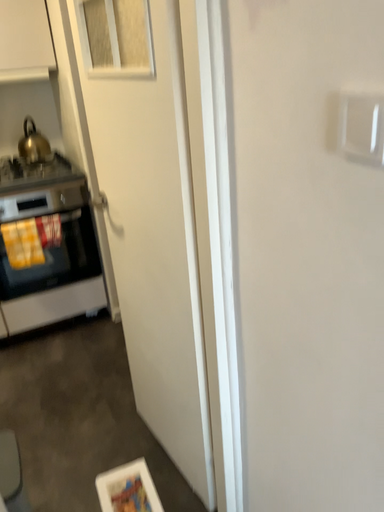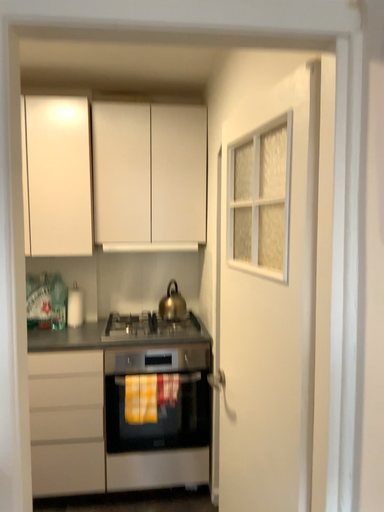
Question: Which way did the camera rotate in the video?

Choices:
 (A) rotated right
 (B) rotated left

Answer: (B)